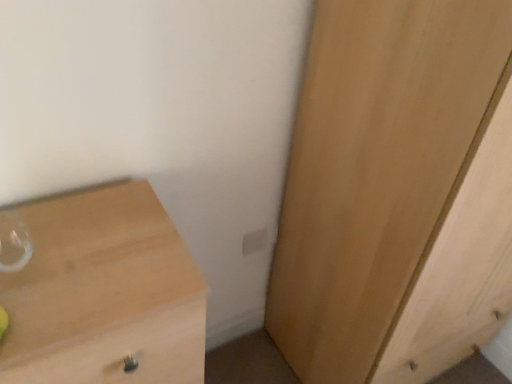
Locate an element on the screen. free space above light wood chest of drawers at lower left (from a real-world perspective) is located at coordinates (83, 250).